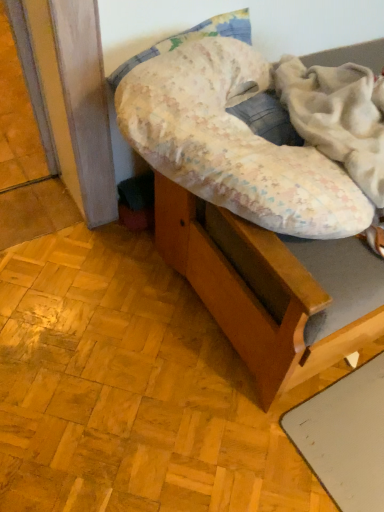
What do you see at coordinates (338, 117) in the screenshot? I see `fluffy white blanket at upper right` at bounding box center [338, 117].

I want to click on fluffy white blanket at upper right, so click(338, 117).

Describe the element at coordinates (272, 288) in the screenshot. I see `wooden bed frame at center` at that location.

Locate an element on the screen. The width and height of the screenshot is (384, 512). wooden bed frame at center is located at coordinates (272, 288).

I want to click on fluffy white blanket at upper right, so click(338, 117).

Which is more to the right, wooden bed frame at center or fluffy white blanket at upper right?

Positioned to the right is wooden bed frame at center.

Is wooden bed frame at center closer to the viewer compared to fluffy white blanket at upper right?

No, wooden bed frame at center is behind fluffy white blanket at upper right.

Is point (228, 305) closer or farther from the camera than point (356, 84)?

Clearly, point (228, 305) is more distant from the camera than point (356, 84).

From the image's perspective, is wooden bed frame at center on fluffy white blanket at upper right?

Correct, wooden bed frame at center appears higher than fluffy white blanket at upper right in the image.

From a real-world perspective, is wooden bed frame at center on top of fluffy white blanket at upper right?

No.

Between wooden bed frame at center and fluffy white blanket at upper right, which one has smaller width?

With smaller width is fluffy white blanket at upper right.

Who is taller, wooden bed frame at center or fluffy white blanket at upper right?

With more height is wooden bed frame at center.

Considering the sizes of objects wooden bed frame at center and fluffy white blanket at upper right in the image provided, who is bigger, wooden bed frame at center or fluffy white blanket at upper right?

wooden bed frame at center is bigger.

Would you say wooden bed frame at center is outside fluffy white blanket at upper right?

wooden bed frame at center is positioned outside fluffy white blanket at upper right.

Is wooden bed frame at center far away from fluffy white blanket at upper right?

Actually, wooden bed frame at center and fluffy white blanket at upper right are a little close together.

Is wooden bed frame at center aimed at fluffy white blanket at upper right?

No, wooden bed frame at center is not oriented towards fluffy white blanket at upper right.

How many degrees apart are the facing directions of wooden bed frame at center and fluffy white blanket at upper right?

The facing directions of wooden bed frame at center and fluffy white blanket at upper right are 0.953 degrees apart.

Where is `blanket above the wooden bed frame at center (from a real-world perspective)`? This screenshot has width=384, height=512. blanket above the wooden bed frame at center (from a real-world perspective) is located at coordinates (338, 117).

Considering the positions of objects fluffy white blanket at upper right and wooden bed frame at center in the image provided, who is more to the left, fluffy white blanket at upper right or wooden bed frame at center?

Positioned to the left is fluffy white blanket at upper right.

Considering the relative positions of fluffy white blanket at upper right and wooden bed frame at center in the image provided, is fluffy white blanket at upper right in front of wooden bed frame at center?

Yes, it is in front of wooden bed frame at center.

Considering the points (354, 110) and (274, 298), which point is in front, point (354, 110) or point (274, 298)?

The point (354, 110) is in front.

From the image's perspective, is fluffy white blanket at upper right below wooden bed frame at center?

Correct, fluffy white blanket at upper right appears lower than wooden bed frame at center in the image.

From a real-world perspective, is fluffy white blanket at upper right on wooden bed frame at center?

Yes.

From the picture: Considering the sizes of objects fluffy white blanket at upper right and wooden bed frame at center in the image provided, who is thinner, fluffy white blanket at upper right or wooden bed frame at center?

Thinner between the two is fluffy white blanket at upper right.

Between fluffy white blanket at upper right and wooden bed frame at center, which one has more height?

With more height is wooden bed frame at center.

Between fluffy white blanket at upper right and wooden bed frame at center, which one has smaller size?

With smaller size is fluffy white blanket at upper right.

Is wooden bed frame at center a part of fluffy white blanket at upper right?

No, fluffy white blanket at upper right does not contain wooden bed frame at center.

Are fluffy white blanket at upper right and wooden bed frame at center far apart?

No, fluffy white blanket at upper right is not far away from wooden bed frame at center.

Could you tell me if fluffy white blanket at upper right is facing wooden bed frame at center?

No.

Can you tell me how much fluffy white blanket at upper right and wooden bed frame at center differ in facing direction?

The facing directions of fluffy white blanket at upper right and wooden bed frame at center are 0.953 degrees apart.

Based on the photo, measure the distance between fluffy white blanket at upper right and wooden bed frame at center.

A distance of 12.55 inches exists between fluffy white blanket at upper right and wooden bed frame at center.

Where is `blanket above the wooden bed frame at center (from a real-world perspective)`? blanket above the wooden bed frame at center (from a real-world perspective) is located at coordinates (338, 117).

At what (x,y) coordinates should I click in order to perform the action: click on furniture lying behind the fluffy white blanket at upper right. Please return your answer as a coordinate pair (x, y). Looking at the image, I should click on (272, 288).

Where is `furniture above the fluffy white blanket at upper right (from the image's perspective)`? The height and width of the screenshot is (512, 384). furniture above the fluffy white blanket at upper right (from the image's perspective) is located at coordinates (272, 288).